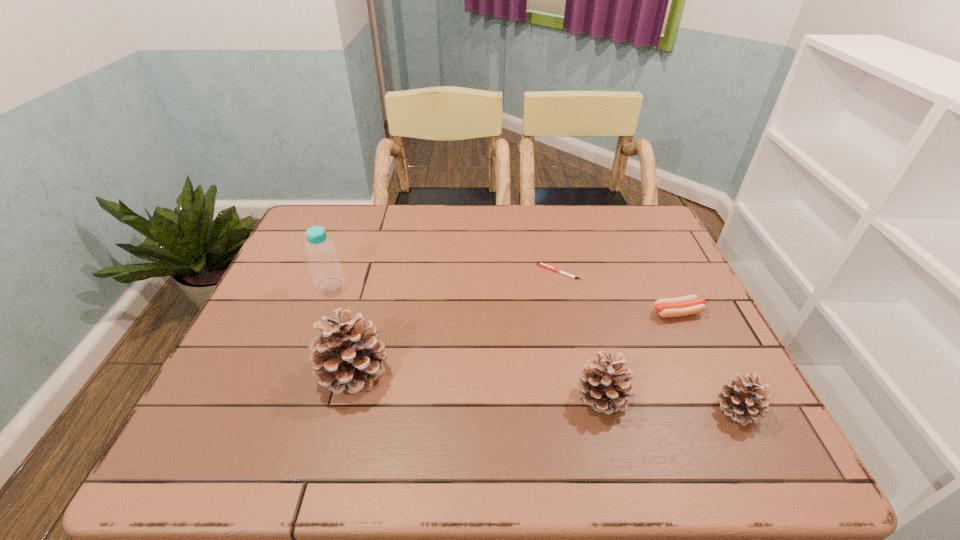
Where is `the second object from left to right`? the second object from left to right is located at coordinates (349, 357).

Find the location of a particular element. Image resolution: width=960 pixels, height=540 pixels. the tallest pinecone is located at coordinates (349, 357).

The height and width of the screenshot is (540, 960). Identify the location of the third tallest object. (604, 385).

Locate an element on the screen. The image size is (960, 540). the second shortest pinecone is located at coordinates (604, 385).

At what (x,y) coordinates should I click in order to perform the action: click on the fourth tallest object. Please return your answer as a coordinate pair (x, y). This screenshot has width=960, height=540. Looking at the image, I should click on (742, 399).

The width and height of the screenshot is (960, 540). I want to click on the rightmost pinecone, so click(742, 399).

Locate an element on the screen. the leftmost object is located at coordinates (325, 267).

The height and width of the screenshot is (540, 960). Identify the location of the fifth tallest object. (687, 305).

Image resolution: width=960 pixels, height=540 pixels. Find the location of `the fourth nearest object`. the fourth nearest object is located at coordinates (687, 305).

Where is `the shortest object`? The width and height of the screenshot is (960, 540). the shortest object is located at coordinates (540, 264).